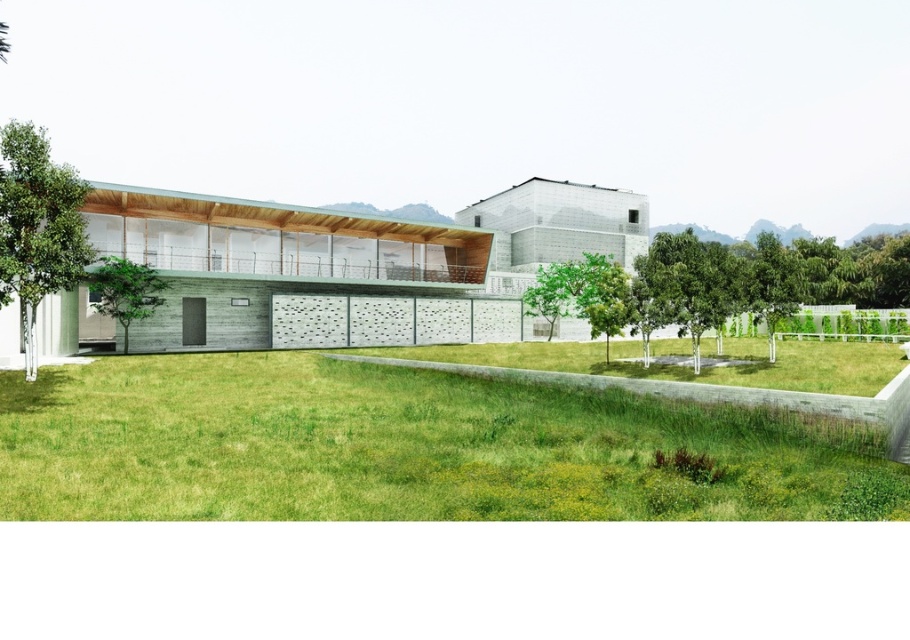
Between green leafy tree at lower right and green textured tree at left, which one has less height?

Standing shorter between the two is green textured tree at left.

This screenshot has height=640, width=910. Describe the element at coordinates (742, 280) in the screenshot. I see `green leafy tree at lower right` at that location.

Find the location of a particular element. This screenshot has width=910, height=640. green leafy tree at lower right is located at coordinates (742, 280).

Find the location of `green leafy tree at lower right`. green leafy tree at lower right is located at coordinates (742, 280).

Which is below, green grass at lower center or green leafy tree at left?

green grass at lower center is lower down.

Does green grass at lower center have a lesser height compared to green leafy tree at left?

Correct, green grass at lower center is not as tall as green leafy tree at left.

What do you see at coordinates (407, 448) in the screenshot?
I see `green grass at lower center` at bounding box center [407, 448].

Locate an element on the screen. The image size is (910, 640). green grass at lower center is located at coordinates (407, 448).

Does green grass at lower center come in front of green textured tree at left?

Yes, green grass at lower center is in front of green textured tree at left.

Is green grass at lower center to the right of green textured tree at left from the viewer's perspective?

Indeed, green grass at lower center is positioned on the right side of green textured tree at left.

Find the location of a particular element. Image resolution: width=910 pixels, height=640 pixels. green grass at lower center is located at coordinates (407, 448).